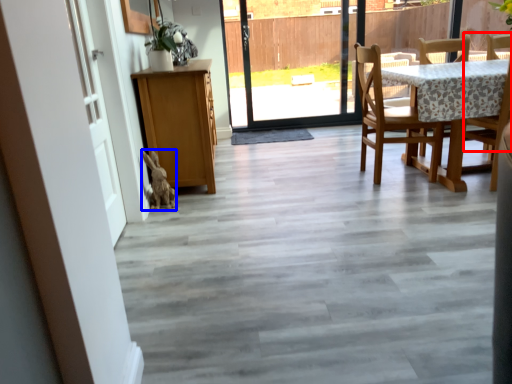
Question: Among these objects, which one is farthest to the camera, chair (highlighted by a red box) or animal (highlighted by a blue box)?

Choices:
 (A) chair
 (B) animal

Answer: (B)